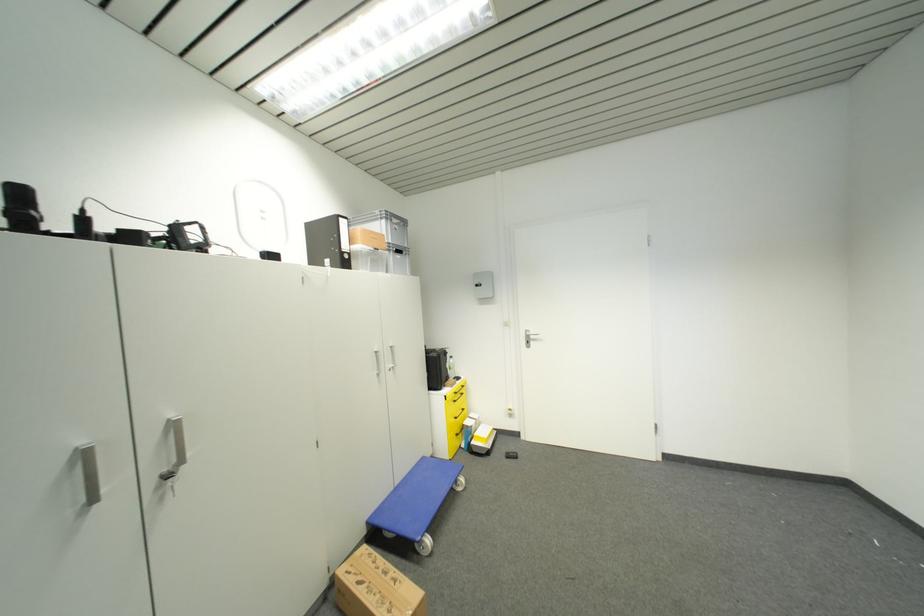
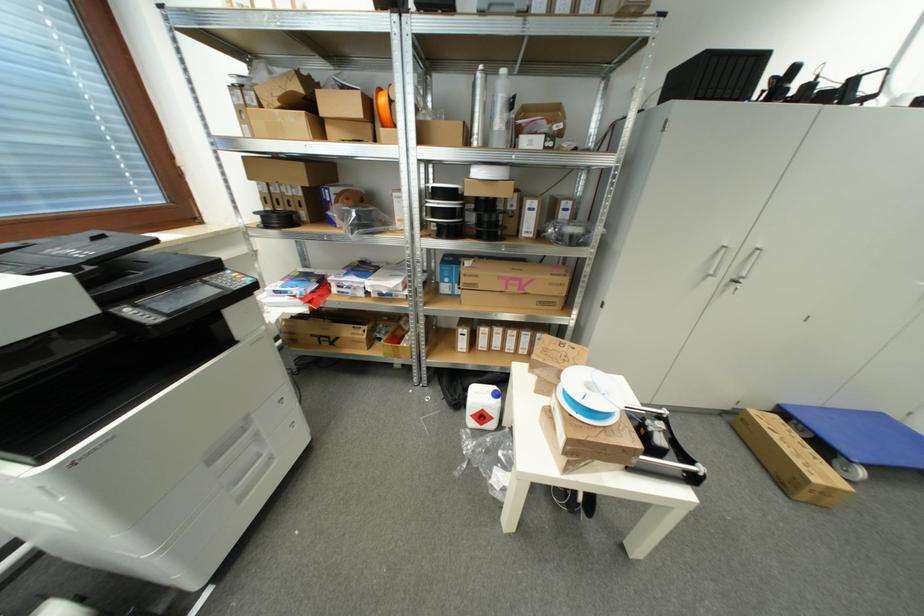
Where in the second image is the point corresponding to [428,461] from the first image?

(885, 418)